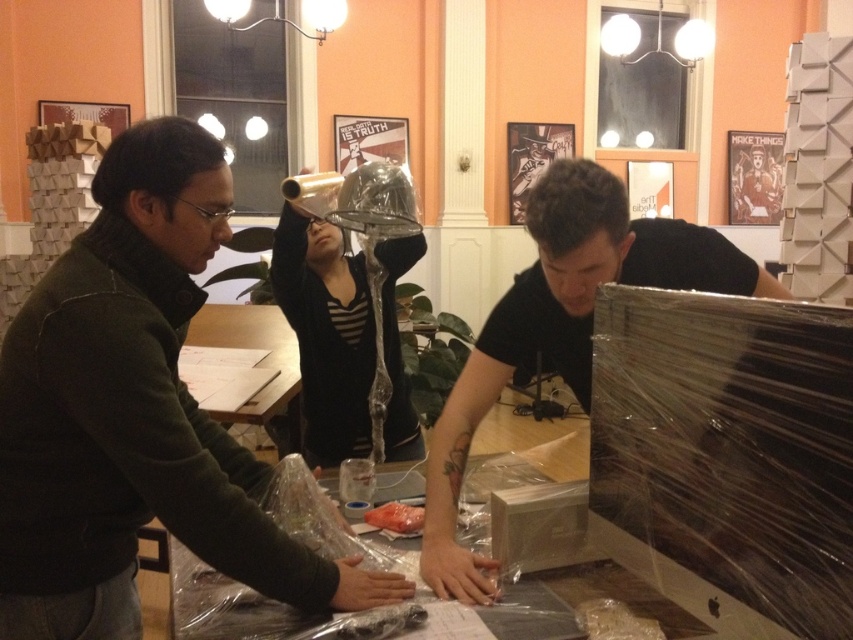
Question: Which point is farther to the camera?

Choices:
 (A) clear plastic bag at center
 (B) clear plastic table at center
 (C) matte black shirt at center
 (D) matte black jacket at left

Answer: (A)

Question: Which of these objects is positioned closest to the clear plastic table at center?

Choices:
 (A) clear plastic bag at center
 (B) matte black jacket at left
 (C) matte black shirt at center

Answer: (B)

Question: Does clear plastic bag at center come behind clear plastic table at center?

Choices:
 (A) yes
 (B) no

Answer: (A)

Question: Can you confirm if matte black jacket at left is wider than clear plastic table at center?

Choices:
 (A) no
 (B) yes

Answer: (A)

Question: Which object is the closest to the clear plastic bag at center?

Choices:
 (A) clear plastic table at center
 (B) matte black jacket at left
 (C) matte black shirt at center

Answer: (C)

Question: Does matte black jacket at left appear under clear plastic table at center?

Choices:
 (A) no
 (B) yes

Answer: (A)